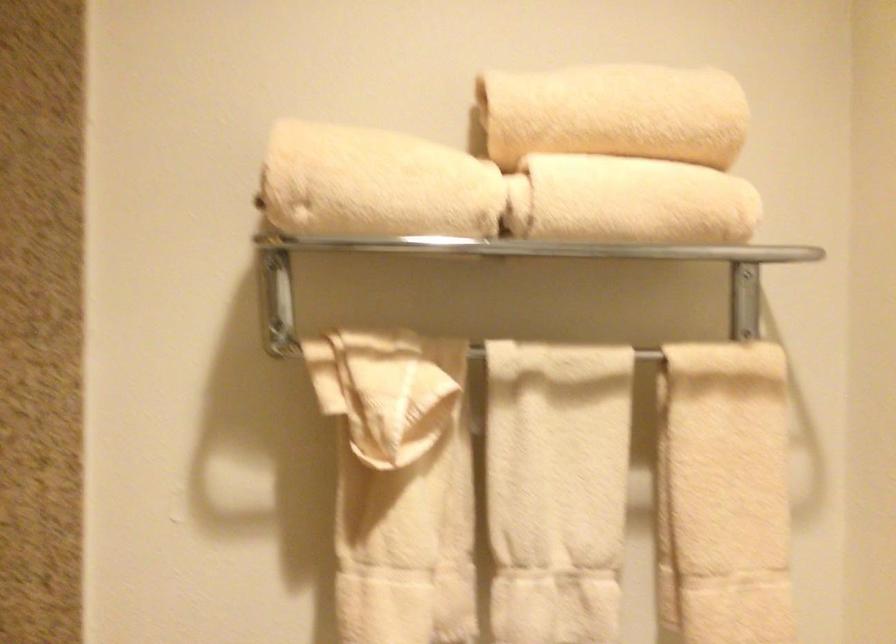
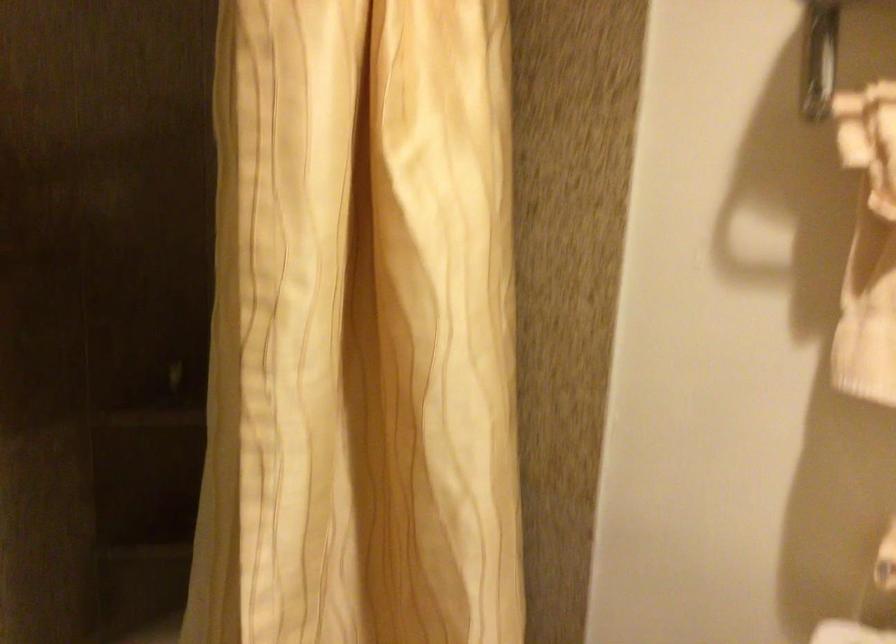
Question: The images are taken continuously from a first-person perspective. In which direction is your viewpoint rotating?

Choices:
 (A) Left
 (B) Right
 (C) Up
 (D) Down

Answer: (A)